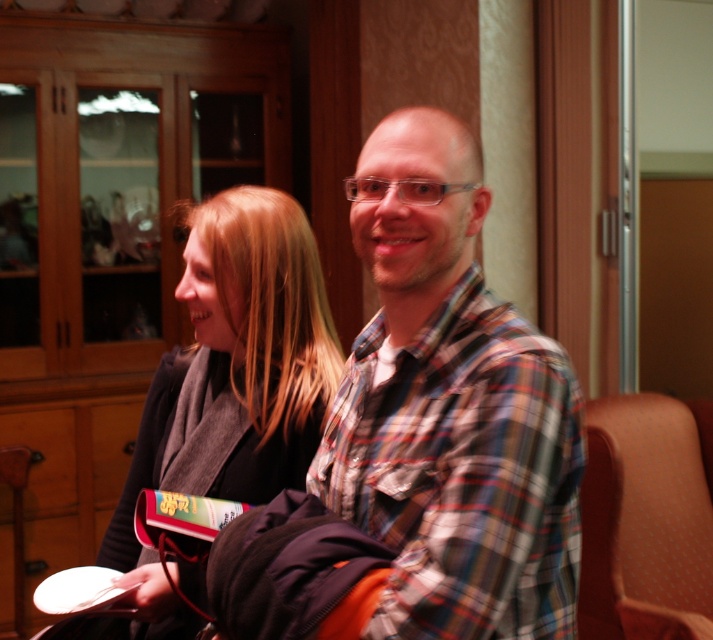
You are standing in the room and want to locate the plaid shirt at center. According to the coordinates provided, where would you find it?

The plaid shirt at center is located at coordinates point (451, 408).

Based on the photo, you are a photographer trying to capture a clear shot of both the matte black jacket at center and the orange fabric chair at right. Since you want to focus on the jacket first, which object should you adjust your camera focus on first and why?

You should focus on the matte black jacket at center first because it is closer to the viewer than the orange fabric chair at right, so adjusting focus starting from the closer object ensures clarity before adjusting for the farther one.

You are standing in the room and want to pick up the matte black jacket at center. Based on its position, where exactly would you look to find it?

The matte black jacket at center is located at point (230, 387), so you should look towards those coordinates to find it.